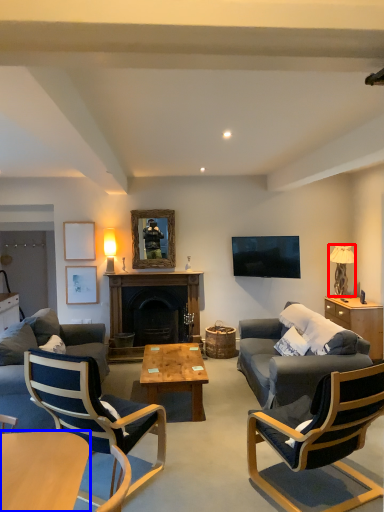
Question: Which object is further to the camera taking this photo, lamp (highlighted by a red box) or coffee table (highlighted by a blue box)?

Choices:
 (A) lamp
 (B) coffee table

Answer: (A)